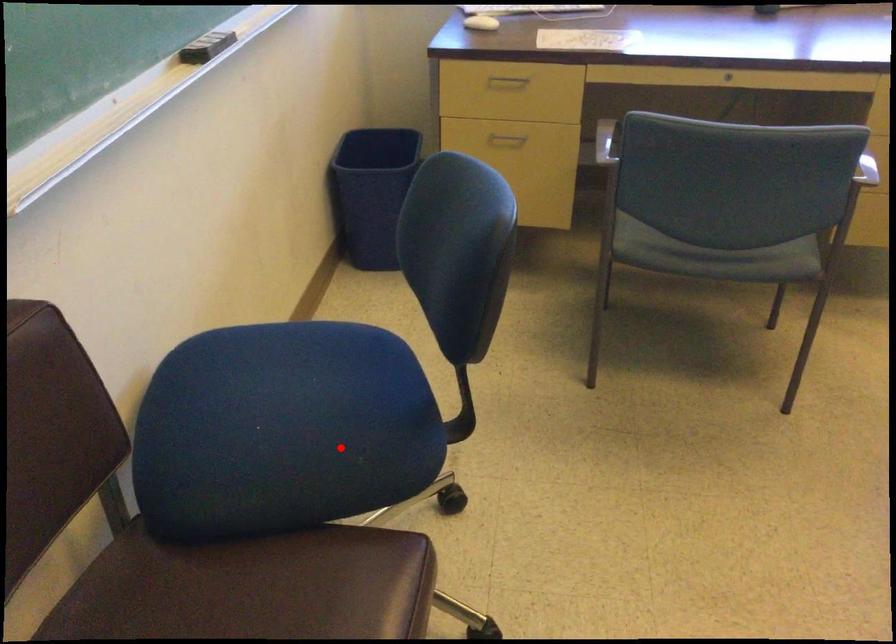
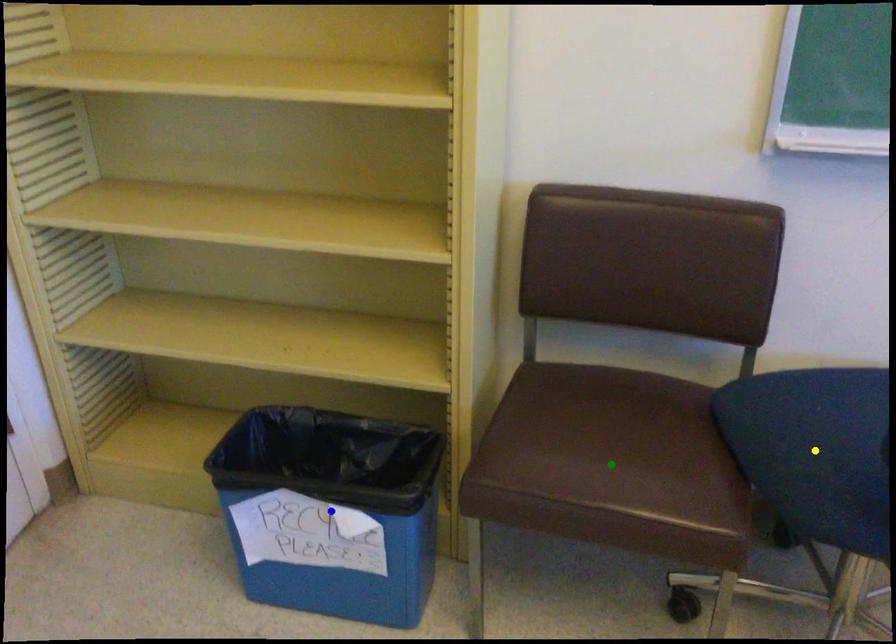
Question: I am providing you with two images of the same scene from different viewpoints. A red point is marked on the first image. You are given multiple points on the second image. Which spot in image 2 lines up with the point in image 1?

Choices:
 (A) yellow point
 (B) green point
 (C) blue point

Answer: (A)